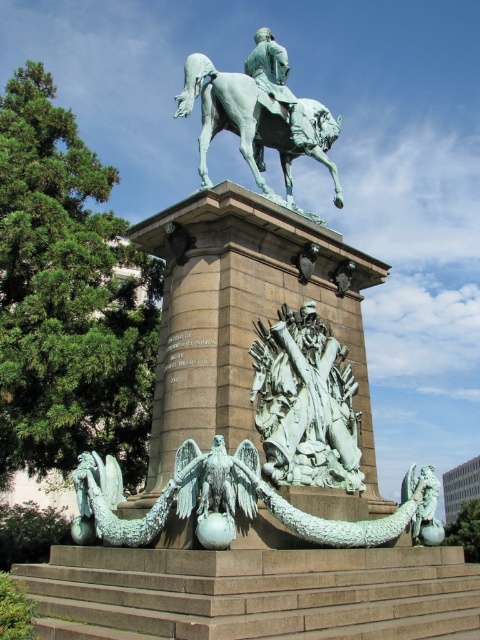
You are a tour guide standing at the base of the equestrian statue. A visitor asks if they can touch the green patina horse at upper center. Considering the distance between you and the horse, explain whether this is possible without any equipment.

The green patina horse at upper center is 40.76 meters away from the viewer, which is too far to reach without any equipment. Therefore, visitors cannot touch it safely from the current position.

You are standing in front of the grand equestrian statue. If you want to take a photo of the green patina statue at center from directly in front, which direction should you face?

You should face the direction where the green patina statue at center is located, which is at the center position in the image.